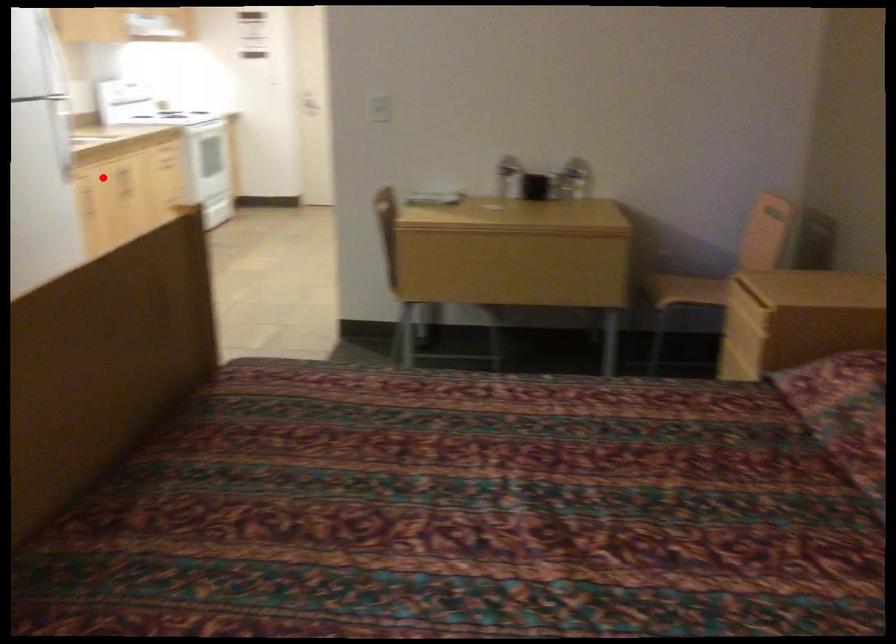
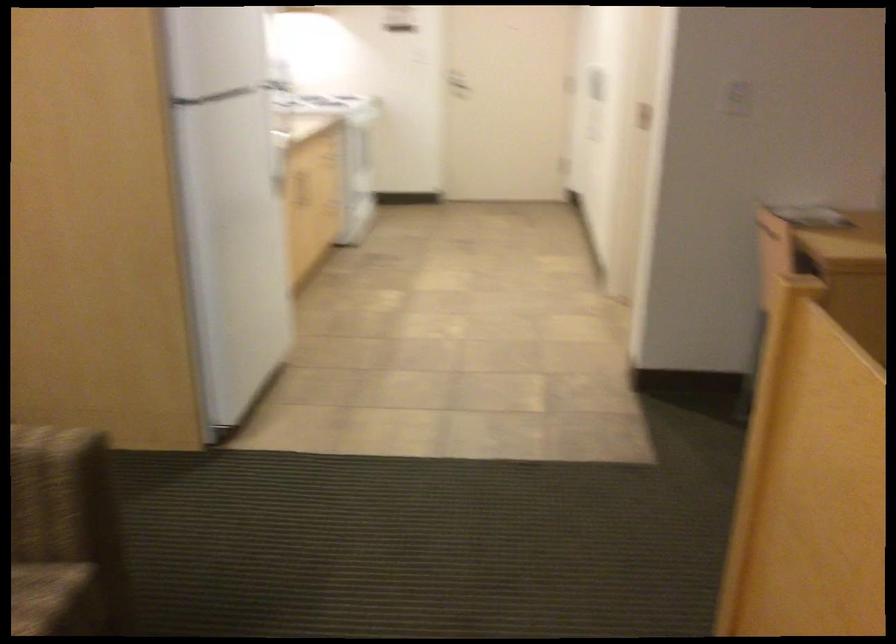
The point at the highlighted location is marked in the first image. Where is the corresponding point in the second image?

(297, 187)